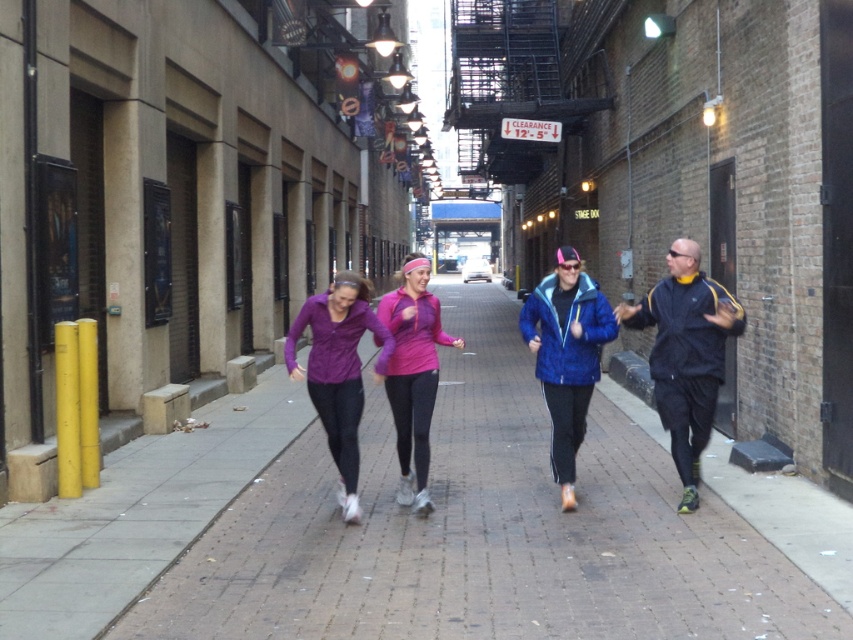
Question: Is dark blue track suit at right thinner than purple matte jacket at center?

Choices:
 (A) yes
 (B) no

Answer: (B)

Question: Which object appears farthest from the camera in this image?

Choices:
 (A) brick pavement at center
 (B) dark blue track suit at right
 (C) pink matte headband at center

Answer: (C)

Question: Which point is closer to the camera?

Choices:
 (A) pink matte headband at center
 (B) dark blue track suit at right
 (C) blue matte jacket at center
 (D) brick pavement at center

Answer: (D)

Question: Can you confirm if dark blue track suit at right is positioned below pink matte headband at center?

Choices:
 (A) no
 (B) yes

Answer: (A)

Question: Which object appears closest to the camera in this image?

Choices:
 (A) brick pavement at center
 (B) purple matte jacket at center

Answer: (A)

Question: Where is blue matte jacket at center located in relation to pink matte headband at center in the image?

Choices:
 (A) right
 (B) left

Answer: (A)